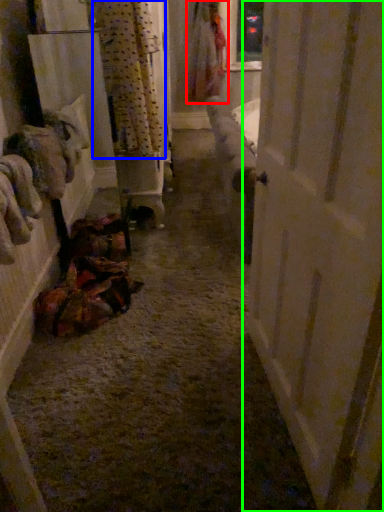
Question: Estimate the real-world distances between objects in this image. Which object is closer to clothing (highlighted by a red box), curtain (highlighted by a blue box) or door (highlighted by a green box)?

Choices:
 (A) curtain
 (B) door

Answer: (A)